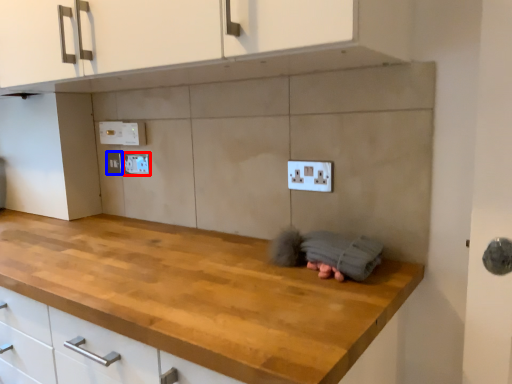
Question: Which object is closer to the camera taking this photo, electric outlet (highlighted by a red box) or electric outlet (highlighted by a blue box)?

Choices:
 (A) electric outlet
 (B) electric outlet

Answer: (A)